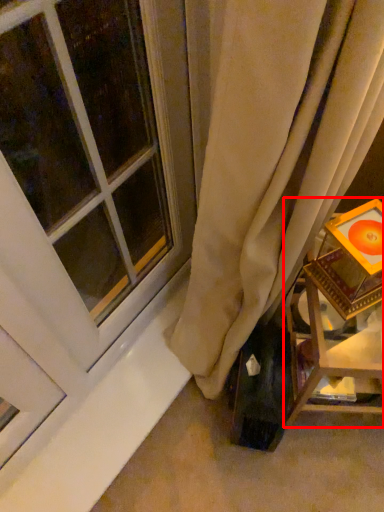
Question: Where is furniture (annotated by the red box) located in relation to window in the image?

Choices:
 (A) right
 (B) left

Answer: (A)